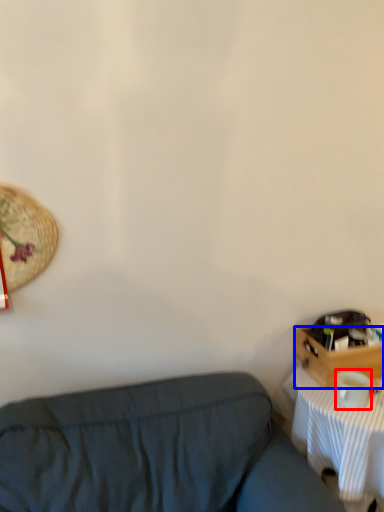
Question: Which object appears farthest to the camera in this image, coffee cup (highlighted by a red box) or drawer (highlighted by a blue box)?

Choices:
 (A) coffee cup
 (B) drawer

Answer: (B)